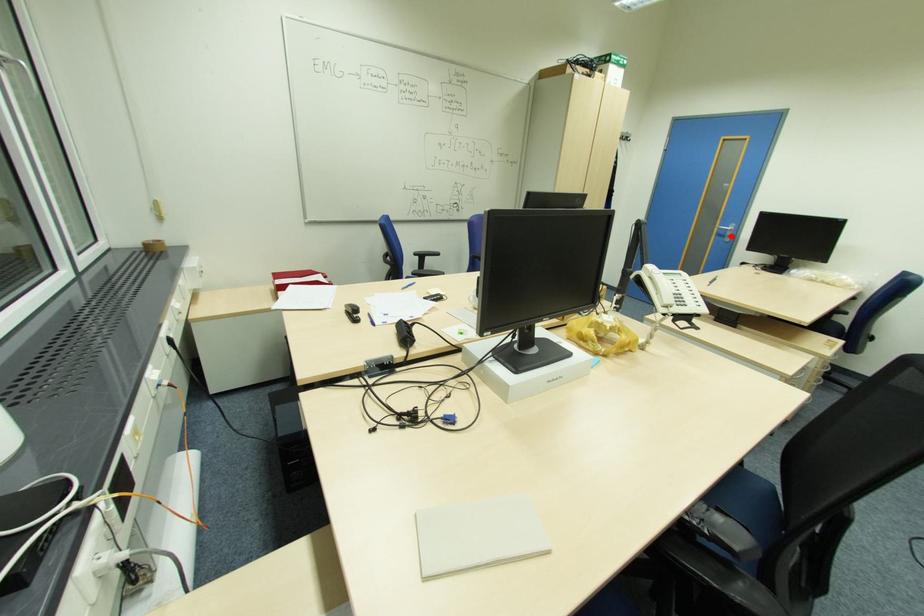
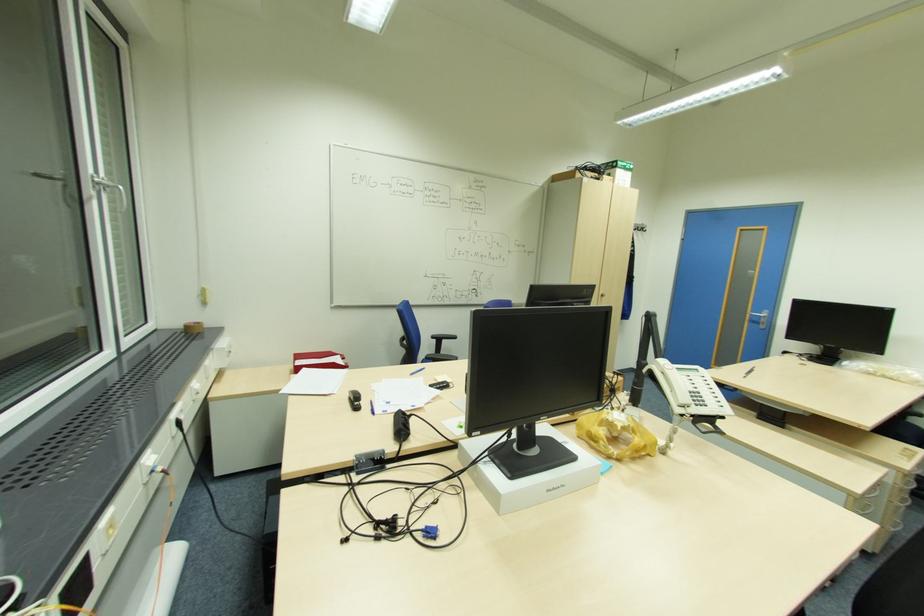
Find the pixel in the second image that matches the highlighted location in the first image.

(766, 323)